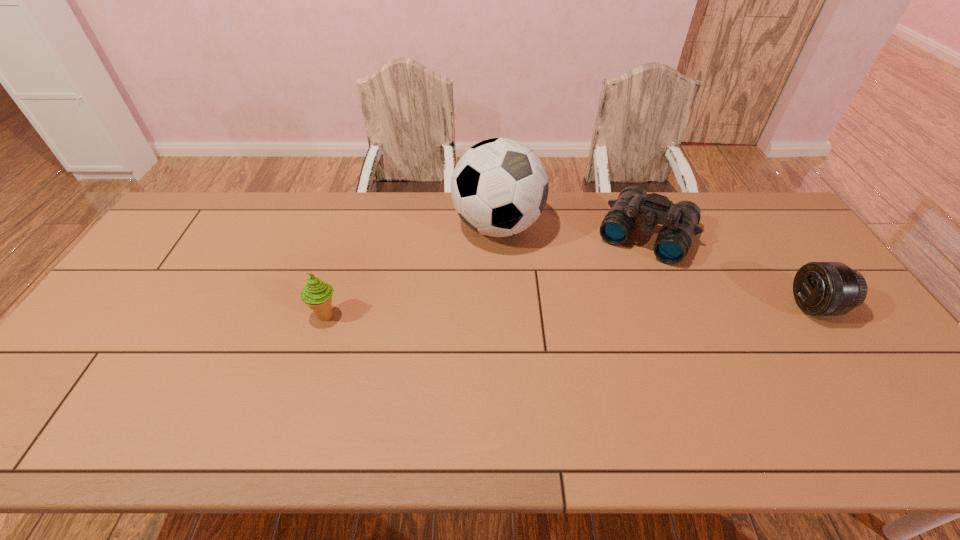
The width and height of the screenshot is (960, 540). In order to click on vacant space on the desktop that is between the leftmost object and the telephoto lens and is positioned through the lenses of the binoculars in this screenshot , I will do `click(609, 310)`.

Locate an element on the screen. This screenshot has width=960, height=540. free space on the desktop that is between the icecream and the rightmost object and is positioned on the main logo of the tallest object is located at coordinates (605, 310).